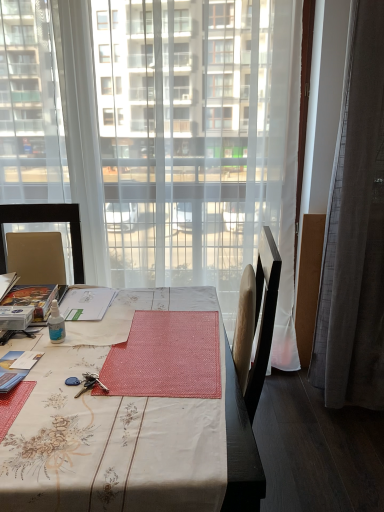
At what (x,y) coordinates should I click in order to perform the action: click on gray fabric curtain at right. Please return your answer as a coordinate pair (x, y). The height and width of the screenshot is (512, 384). Looking at the image, I should click on (355, 229).

Locate an element on the screen. Image resolution: width=384 pixels, height=512 pixels. transparent curtain at center is located at coordinates (199, 142).

Where is `gray fabric curtain at right`? gray fabric curtain at right is located at coordinates (355, 229).

Can you see transparent plastic bottle at table center touching floral-patterned fabric desk at center?

transparent plastic bottle at table center and floral-patterned fabric desk at center are not in contact.

Is transparent plastic bottle at table center positioned with its back to floral-patterned fabric desk at center?

transparent plastic bottle at table center is not turned away from floral-patterned fabric desk at center.

From a real-world perspective, is transparent plastic bottle at table center physically below floral-patterned fabric desk at center?

Incorrect, from a real-world perspective, transparent plastic bottle at table center is higher than floral-patterned fabric desk at center.

From the image's perspective, which is above, transparent plastic bottle at table center or floral-patterned fabric desk at center?

transparent plastic bottle at table center.

Is transparent plastic bottle at table center positioned far away from gray fabric curtain at right?

Indeed, transparent plastic bottle at table center is not near gray fabric curtain at right.

Considering the relative sizes of transparent plastic bottle at table center and gray fabric curtain at right in the image provided, is transparent plastic bottle at table center wider than gray fabric curtain at right?

No.

Which is behind, transparent curtain at center or floral-patterned fabric desk at center?

transparent curtain at center is further away from the camera.

The image size is (384, 512). Find the location of `window located on the right of floral-patterned fabric desk at center`. window located on the right of floral-patterned fabric desk at center is located at coordinates (199, 142).

In terms of height, does transparent curtain at center look taller or shorter compared to floral-patterned fabric desk at center?

In the image, transparent curtain at center appears to be taller than floral-patterned fabric desk at center.

Does transparent curtain at center touch floral-patterned fabric desk at center?

No.

Can you confirm if floral-patterned fabric desk at center is shorter than transparent curtain at center?

Yes.

From the image's perspective, relative to transparent curtain at center, is floral-patterned fabric desk at center above or below?

floral-patterned fabric desk at center is below transparent curtain at center.

Is floral-patterned fabric desk at center positioned far away from transparent curtain at center?

No.

Is floral-patterned fabric desk at center oriented towards gray fabric curtain at right?

No, floral-patterned fabric desk at center does not turn towards gray fabric curtain at right.

Is floral-patterned fabric desk at center outside of gray fabric curtain at right?

Indeed, floral-patterned fabric desk at center is completely outside gray fabric curtain at right.

In the image, is floral-patterned fabric desk at center on the left side or the right side of gray fabric curtain at right?

Clearly, floral-patterned fabric desk at center is on the left of gray fabric curtain at right in the image.

How different are the orientations of floral-patterned fabric desk at center and gray fabric curtain at right in degrees?

There is a 4.63-degree angle between the facing directions of floral-patterned fabric desk at center and gray fabric curtain at right.

Considering the relative positions of gray fabric curtain at right and transparent curtain at center in the image provided, is gray fabric curtain at right to the right of transparent curtain at center from the viewer's perspective?

Result: Yes.

Considering the relative sizes of gray fabric curtain at right and transparent curtain at center in the image provided, is gray fabric curtain at right bigger than transparent curtain at center?

Correct, gray fabric curtain at right is larger in size than transparent curtain at center.

Does gray fabric curtain at right turn towards transparent curtain at center?

No.

From a real-world perspective, which object stands above the other?

transparent curtain at center.

Considering the positions of point (161, 73) and point (346, 87), is point (161, 73) closer or farther from the camera than point (346, 87)?

Point (161, 73) appears to be farther away from the viewer than point (346, 87).

Is transparent curtain at center shorter than gray fabric curtain at right?

Yes.

Could you tell me if transparent curtain at center is facing gray fabric curtain at right?

No, transparent curtain at center is not oriented towards gray fabric curtain at right.

Where is `bottle behind the floral-patterned fabric desk at center`? bottle behind the floral-patterned fabric desk at center is located at coordinates (56, 324).

Where is `bottle that is below the gray fabric curtain at right (from the image's perspective)`? Image resolution: width=384 pixels, height=512 pixels. bottle that is below the gray fabric curtain at right (from the image's perspective) is located at coordinates (56, 324).

Considering their positions, is transparent plastic bottle at table center positioned closer to gray fabric curtain at right than transparent curtain at center?

transparent curtain at center is positioned closer to the anchor gray fabric curtain at right.

Looking at the image, which one is located closer to transparent curtain at center, transparent plastic bottle at table center or floral-patterned fabric desk at center?

floral-patterned fabric desk at center is closer to transparent curtain at center.

Estimate the real-world distances between objects in this image. Which object is closer to gray fabric curtain at right, floral-patterned fabric desk at center or transparent plastic bottle at table center?

floral-patterned fabric desk at center.

Estimate the real-world distances between objects in this image. Which object is further from floral-patterned fabric desk at center, gray fabric curtain at right or transparent plastic bottle at table center?

The object further to floral-patterned fabric desk at center is gray fabric curtain at right.

Considering their positions, is gray fabric curtain at right positioned closer to transparent plastic bottle at table center than transparent curtain at center?

transparent curtain at center.

Estimate the real-world distances between objects in this image. Which object is closer to floral-patterned fabric desk at center, transparent curtain at center or gray fabric curtain at right?

transparent curtain at center is closer to floral-patterned fabric desk at center.

Looking at the image, which one is located further to gray fabric curtain at right, transparent plastic bottle at table center or floral-patterned fabric desk at center?

transparent plastic bottle at table center is further to gray fabric curtain at right.

Which object lies nearer to the anchor point transparent plastic bottle at table center, transparent curtain at center or floral-patterned fabric desk at center?

The object closer to transparent plastic bottle at table center is floral-patterned fabric desk at center.

Identify the location of window between transparent plastic bottle at table center and gray fabric curtain at right in the horizontal direction. (199, 142).

Image resolution: width=384 pixels, height=512 pixels. I want to click on window between floral-patterned fabric desk at center and gray fabric curtain at right from left to right, so click(x=199, y=142).

Locate an element on the screen. Image resolution: width=384 pixels, height=512 pixels. bottle between transparent curtain at center and floral-patterned fabric desk at center vertically is located at coordinates (56, 324).

The image size is (384, 512). What are the coordinates of `desk between transparent plastic bottle at table center and gray fabric curtain at right` in the screenshot? It's located at [x=131, y=437].